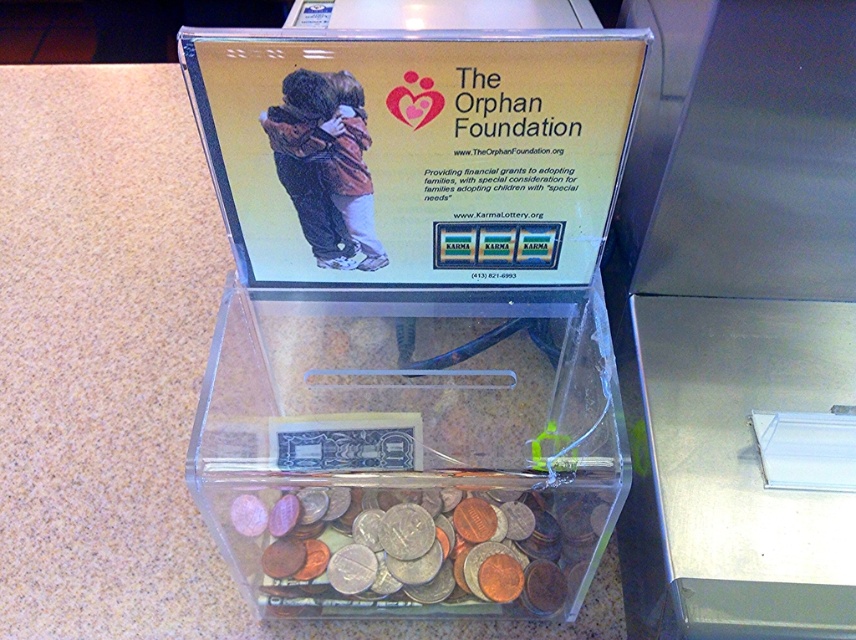
Who is higher up, transparent plastic box at center or shiny metallic coins at center?

transparent plastic box at center

Is transparent plastic box at center shorter than shiny metallic coins at center?

No, transparent plastic box at center is not shorter than shiny metallic coins at center.

This screenshot has width=856, height=640. I want to click on transparent plastic box at center, so click(x=409, y=451).